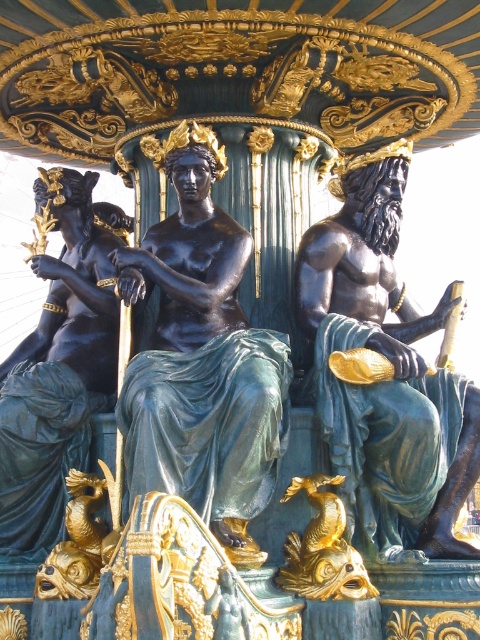
Does bronze statue at center lie behind bronze statue at left?

No.

Can you confirm if bronze statue at center is smaller than bronze statue at left?

Correct, bronze statue at center occupies less space than bronze statue at left.

What do you see at coordinates (201, 353) in the screenshot?
I see `bronze statue at center` at bounding box center [201, 353].

Where is `bronze statue at center`? Image resolution: width=480 pixels, height=640 pixels. bronze statue at center is located at coordinates (201, 353).

Does bronze statue at center appear on the left side of black polished stone man at center?

Indeed, bronze statue at center is positioned on the left side of black polished stone man at center.

Can you confirm if bronze statue at center is bigger than black polished stone man at center?

No.

Describe the element at coordinates (201, 353) in the screenshot. This screenshot has width=480, height=640. I see `bronze statue at center` at that location.

At what (x,y) coordinates should I click in order to perform the action: click on bronze statue at center. Please return your answer as a coordinate pair (x, y). Image resolution: width=480 pixels, height=640 pixels. Looking at the image, I should click on (201, 353).

In the scene shown: Measure the distance from black polished stone man at center to bronze statue at left.

black polished stone man at center and bronze statue at left are 9.64 meters apart.

Who is shorter, black polished stone man at center or bronze statue at left?

bronze statue at left is shorter.

The width and height of the screenshot is (480, 640). What do you see at coordinates (394, 369) in the screenshot?
I see `black polished stone man at center` at bounding box center [394, 369].

Locate an element on the screen. This screenshot has width=480, height=640. black polished stone man at center is located at coordinates (394, 369).